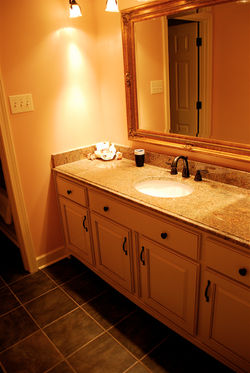
Identify the location of lights. (76, 12), (112, 5).